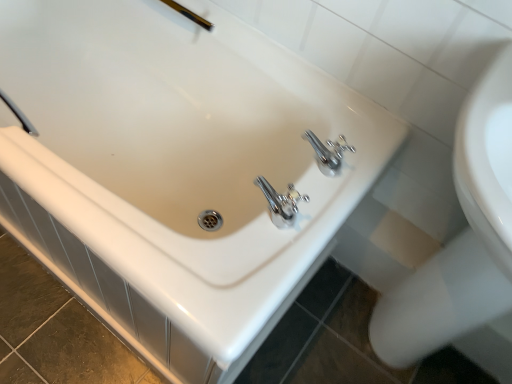
Question: From a real-world perspective, is gold metallic shower head at upper center physically below white glossy bidet at lower right?

Choices:
 (A) no
 (B) yes

Answer: (A)

Question: Is gold metallic shower head at upper center at the right side of white glossy bidet at lower right?

Choices:
 (A) no
 (B) yes

Answer: (A)

Question: Is gold metallic shower head at upper center located outside white glossy bidet at lower right?

Choices:
 (A) yes
 (B) no

Answer: (A)

Question: Is gold metallic shower head at upper center to the left of white glossy bidet at lower right from the viewer's perspective?

Choices:
 (A) yes
 (B) no

Answer: (A)

Question: From the image's perspective, is gold metallic shower head at upper center under white glossy bidet at lower right?

Choices:
 (A) yes
 (B) no

Answer: (B)

Question: Is the depth of gold metallic shower head at upper center less than that of white glossy bidet at lower right?

Choices:
 (A) no
 (B) yes

Answer: (A)

Question: Is white glossy bidet at lower right taller than gold metallic shower head at upper center?

Choices:
 (A) yes
 (B) no

Answer: (B)

Question: From a real-world perspective, is white glossy bidet at lower right positioned over gold metallic shower head at upper center based on gravity?

Choices:
 (A) yes
 (B) no

Answer: (B)

Question: Can you confirm if white glossy bidet at lower right is smaller than gold metallic shower head at upper center?

Choices:
 (A) yes
 (B) no

Answer: (B)

Question: Is white glossy bidet at lower right shorter than gold metallic shower head at upper center?

Choices:
 (A) no
 (B) yes

Answer: (B)

Question: Is the surface of white glossy bidet at lower right in direct contact with gold metallic shower head at upper center?

Choices:
 (A) yes
 (B) no

Answer: (B)

Question: Can we say white glossy bidet at lower right lies outside gold metallic shower head at upper center?

Choices:
 (A) yes
 (B) no

Answer: (A)

Question: Is gold metallic shower head at upper center located within white glossy sink at upper right?

Choices:
 (A) no
 (B) yes

Answer: (A)